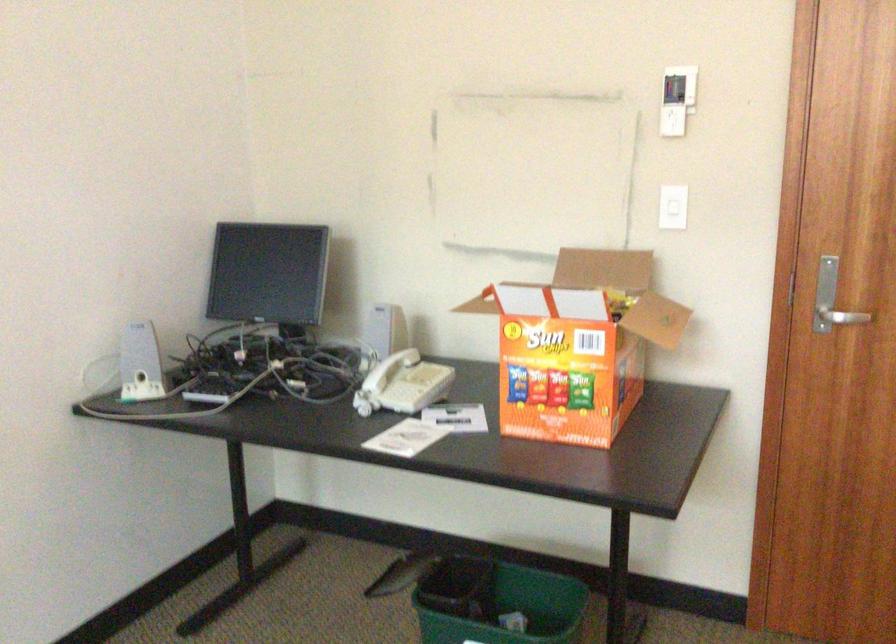
Find where to pull the silver door handle. Please return your answer as a coordinate pair (x, y).

(842, 317)